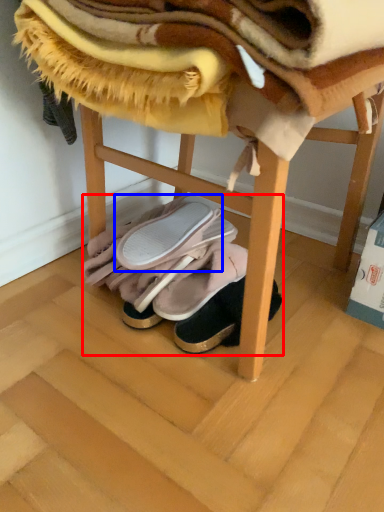
Question: Which object appears closest to the camera in this image, footwear (highlighted by a red box) or footwear (highlighted by a blue box)?

Choices:
 (A) footwear
 (B) footwear

Answer: (B)